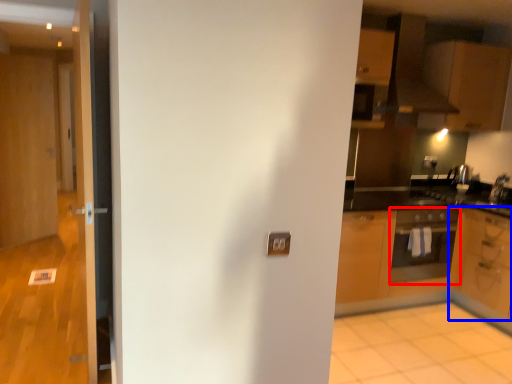
Question: Which of the following is the closest to the observer, oven (highlighted by a red box) or cabinetry (highlighted by a blue box)?

Choices:
 (A) oven
 (B) cabinetry

Answer: (B)